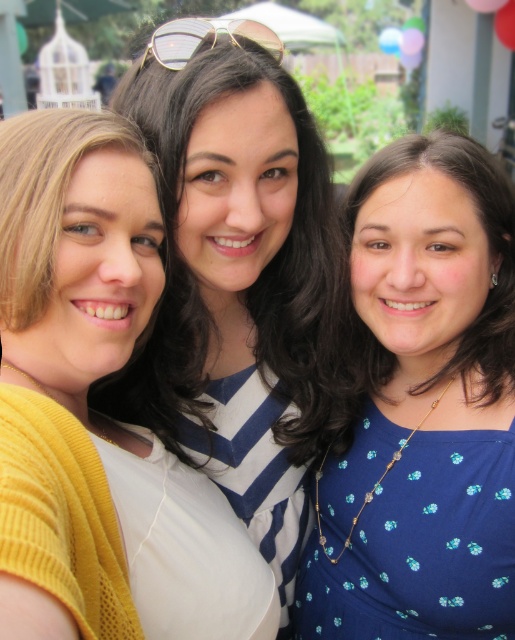
Is blue dotted dress at center positioned behind white matte shirt at center?

Yes, it is behind white matte shirt at center.

Does blue dotted dress at center have a greater width compared to white matte shirt at center?

No, blue dotted dress at center is not wider than white matte shirt at center.

Which is behind, point (362, 173) or point (212, 236)?

The point (212, 236) is more distant.

Find the location of a particular element. Image resolution: width=515 pixels, height=640 pixels. blue dotted dress at center is located at coordinates (421, 406).

Is matte white shirt at center bigger than gold metallic sunglasses at center?

No, matte white shirt at center is not bigger than gold metallic sunglasses at center.

Is matte white shirt at center closer to camera compared to gold metallic sunglasses at center?

That is False.

What do you see at coordinates (95, 412) in the screenshot? I see `matte white shirt at center` at bounding box center [95, 412].

The image size is (515, 640). Identify the location of matte white shirt at center. (95, 412).

Can you confirm if white matte shirt at center is bigger than gold metallic sunglasses at center?

No.

Does white matte shirt at center have a greater width compared to gold metallic sunglasses at center?

In fact, white matte shirt at center might be narrower than gold metallic sunglasses at center.

Find the location of a particular element. This screenshot has width=515, height=640. white matte shirt at center is located at coordinates (236, 275).

I want to click on white matte shirt at center, so click(236, 275).